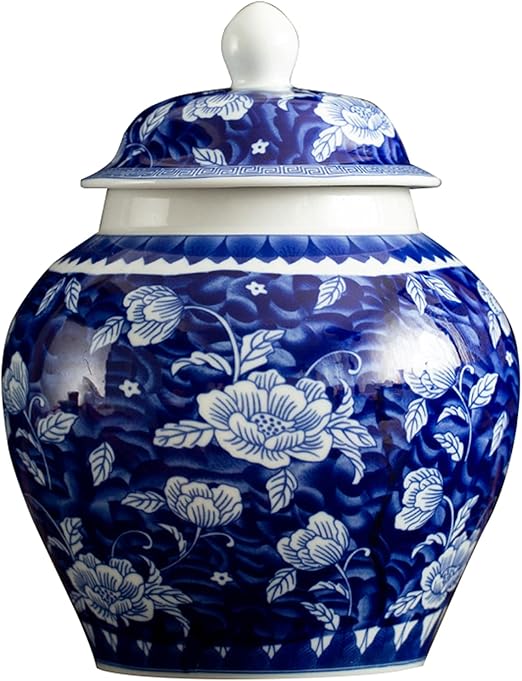
The image size is (522, 681). What are the coordinates of `white knob on top of urn lid` in the screenshot? It's located at click(x=275, y=37).